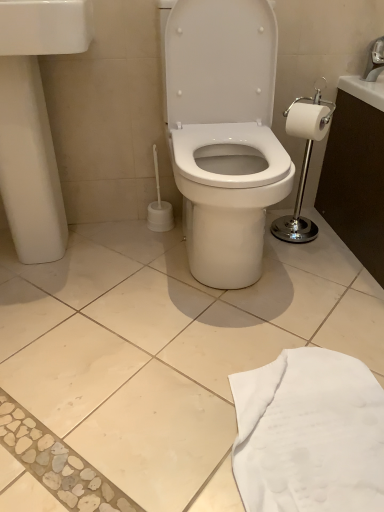
In order to click on silver metallic faucet at upper right in this screenshot , I will do `click(374, 60)`.

The height and width of the screenshot is (512, 384). What do you see at coordinates (374, 60) in the screenshot?
I see `silver metallic faucet at upper right` at bounding box center [374, 60].

The image size is (384, 512). Describe the element at coordinates (309, 434) in the screenshot. I see `white fabric at lower right` at that location.

Where is `white glossy toilet paper at right`? The image size is (384, 512). white glossy toilet paper at right is located at coordinates (307, 121).

Where is `white glossy sink at left`? The width and height of the screenshot is (384, 512). white glossy sink at left is located at coordinates (34, 121).

Is silver metallic faucet at upper right to the left of white fabric at lower right from the viewer's perspective?

In fact, silver metallic faucet at upper right is to the right of white fabric at lower right.

Is silver metallic faucet at upper right closer to the viewer compared to white fabric at lower right?

No, it is behind white fabric at lower right.

Considering the sizes of objects silver metallic faucet at upper right and white fabric at lower right in the image provided, who is taller, silver metallic faucet at upper right or white fabric at lower right?

silver metallic faucet at upper right is taller.

Is silver metallic faucet at upper right placed right next to white fabric at lower right?

silver metallic faucet at upper right and white fabric at lower right are clearly separated.

From a real-world perspective, is white glossy toilet paper at right physically located above or below silver metallic faucet at upper right?

white glossy toilet paper at right is situated lower than silver metallic faucet at upper right in the real world.

Is white glossy toilet paper at right to the left or to the right of silver metallic faucet at upper right in the image?

white glossy toilet paper at right is positioned on silver metallic faucet at upper right's left side.

From the image's perspective, is white glossy toilet paper at right on silver metallic faucet at upper right?

No, from the image's perspective, white glossy toilet paper at right is not over silver metallic faucet at upper right.

From a real-world perspective, who is located lower, white glossy sink at left or white fabric at lower right?

white fabric at lower right, from a real-world perspective.

How far apart are white glossy sink at left and white fabric at lower right?

white glossy sink at left and white fabric at lower right are 3.39 feet apart.

Is white glossy sink at left inside the boundaries of white fabric at lower right, or outside?

The correct answer is: outside.

Is white glossy sink at left oriented towards white fabric at lower right?

No, white glossy sink at left is not aimed at white fabric at lower right.

From the image's perspective, would you say silver metallic faucet at upper right is positioned over white glossy toilet paper at right?

Indeed, from the image's perspective, silver metallic faucet at upper right is shown above white glossy toilet paper at right.

Considering the sizes of objects silver metallic faucet at upper right and white glossy toilet paper at right in the image provided, who is thinner, silver metallic faucet at upper right or white glossy toilet paper at right?

With smaller width is white glossy toilet paper at right.

Is point (12, 40) more distant than point (311, 106)?

No.

In the scene shown: From a real-world perspective, is white glossy sink at left positioned under white glossy toilet paper at right based on gravity?

Indeed, from a real-world perspective, white glossy sink at left is positioned beneath white glossy toilet paper at right.

In the scene shown: From the image's perspective, does white glossy sink at left appear lower than white glossy toilet paper at right?

Yes.

Who is shorter, white glossy sink at left or white glossy toilet paper at right?

white glossy toilet paper at right is shorter.

Is white glossy toilet paper at right not near white glossy sink at left?

No.

Looking at this image, who is shorter, white glossy toilet paper at right or white glossy sink at left?

white glossy toilet paper at right is shorter.

Based on their positions, is white glossy toilet paper at right located to the left or right of white glossy sink at left?

white glossy toilet paper at right is to the right of white glossy sink at left.

Is white glossy toilet paper at right thinner than white glossy sink at left?

Yes, white glossy toilet paper at right is thinner than white glossy sink at left.

Is white glossy toilet paper at right positioned behind white fabric at lower right?

Yes, white glossy toilet paper at right is further from the camera.

Is white glossy toilet paper at right positioned far away from white fabric at lower right?

That's not correct — white glossy toilet paper at right is a little close to white fabric at lower right.

In the scene shown: From the image's perspective, which object appears higher, white glossy toilet paper at right or white fabric at lower right?

white glossy toilet paper at right appears higher in the image.

The width and height of the screenshot is (384, 512). What are the coordinates of `cloth directly beneath the white glossy toilet paper at right (from a real-world perspective)` in the screenshot? It's located at (309, 434).

You are a GUI agent. You are given a task and a screenshot of the screen. Output one action in this format:
    pyautogui.click(x=<x>, y=<y>)
    Task: Click on the cloth below the silver metallic faucet at upper right (from the image's perspective)
    
    Given the screenshot: What is the action you would take?
    pos(309,434)

Locate an element on the screen. toilet paper directly beneath the silver metallic faucet at upper right (from a real-world perspective) is located at coordinates (307, 121).

Which object lies nearer to the anchor point white fabric at lower right, silver metallic faucet at upper right or white glossy toilet paper at right?

white glossy toilet paper at right is closer to white fabric at lower right.

When comparing their distances from white glossy toilet paper at right, does silver metallic faucet at upper right or white fabric at lower right seem further?

white fabric at lower right is positioned further to the anchor white glossy toilet paper at right.

When comparing their distances from silver metallic faucet at upper right, does white fabric at lower right or white glossy toilet paper at right seem closer?

white glossy toilet paper at right is positioned closer to the anchor silver metallic faucet at upper right.

Based on their spatial positions, is white glossy sink at left or white glossy toilet paper at right further from white fabric at lower right?

Among the two, white glossy sink at left is located further to white fabric at lower right.

When comparing their distances from white glossy sink at left, does white glossy toilet paper at right or white fabric at lower right seem closer?

white glossy toilet paper at right lies closer to white glossy sink at left than the other object.

Based on their spatial positions, is silver metallic faucet at upper right or white glossy sink at left closer to white glossy toilet paper at right?

Among the two, silver metallic faucet at upper right is located nearer to white glossy toilet paper at right.

Based on their spatial positions, is white fabric at lower right or white glossy toilet paper at right further from white glossy sink at left?

white fabric at lower right is further to white glossy sink at left.

Which object lies further to the anchor point silver metallic faucet at upper right, white glossy sink at left or white fabric at lower right?

The object further to silver metallic faucet at upper right is white fabric at lower right.

Find the location of a particular element. This screenshot has width=384, height=512. cloth between white glossy sink at left and white glossy toilet paper at right is located at coordinates (309, 434).

Identify the location of toilet paper situated between white glossy sink at left and silver metallic faucet at upper right from left to right. (307, 121).

Identify the location of cloth located between white glossy sink at left and silver metallic faucet at upper right in the left-right direction. Image resolution: width=384 pixels, height=512 pixels. [x=309, y=434].

You are a GUI agent. You are given a task and a screenshot of the screen. Output one action in this format:
    pyautogui.click(x=<x>, y=<y>)
    Task: Click on the toilet paper between silver metallic faucet at upper right and white fabric at lower right from top to bottom
    The height and width of the screenshot is (512, 384).
    Given the screenshot: What is the action you would take?
    pyautogui.click(x=307, y=121)